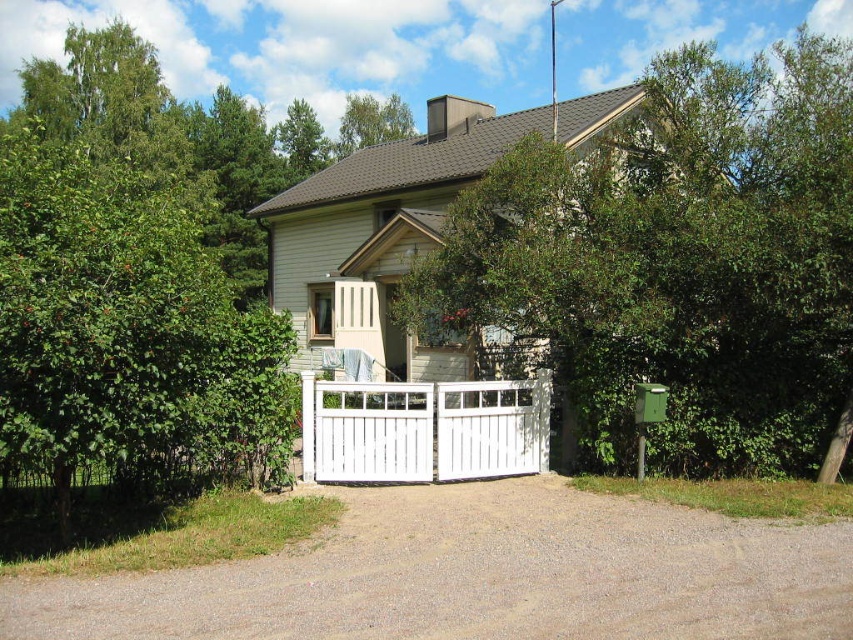
You are standing in front of the house and want to enter through the gate. Which object should you approach first, the brown gravel driveway at center or the white wooden gate at center?

You should approach the white wooden gate at center first because the brown gravel driveway at center is located below it, meaning the gate is closer to your current position.

You are a delivery person approaching the house and need to determine the best path to avoid hitting the green leafy tree at upper center and the white wooden gate at center. Which object should you steer around first?

The green leafy tree at upper center is much taller than the white wooden gate at center, so you should steer around the green leafy tree at upper center first since it is taller and might have a larger canopy that could obstruct the path.

In the scene shown: You are a delivery person approaching the house and need to park your vehicle. The driveway can accommodate vehicles up to 5 meters in length. The gate must be fully opened to allow entry. Given that the brown gravel driveway at center is shorter than the white wooden gate at center, will the driveway be long enough for your 4.5 meter long delivery van?

The brown gravel driveway at center is shorter than the white wooden gate at center. Since the driveway is shorter than the gate, it means the driveway is not long enough to accommodate a 4.5 meter delivery van, so the driveway will not be sufficient.